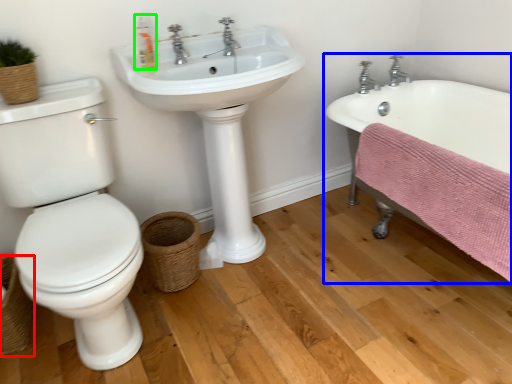
Question: Estimate the real-world distances between objects in this image. Which object is closer to basket (highlighted by a red box), bathtub (highlighted by a blue box) or soap dispenser (highlighted by a green box)?

Choices:
 (A) bathtub
 (B) soap dispenser

Answer: (B)